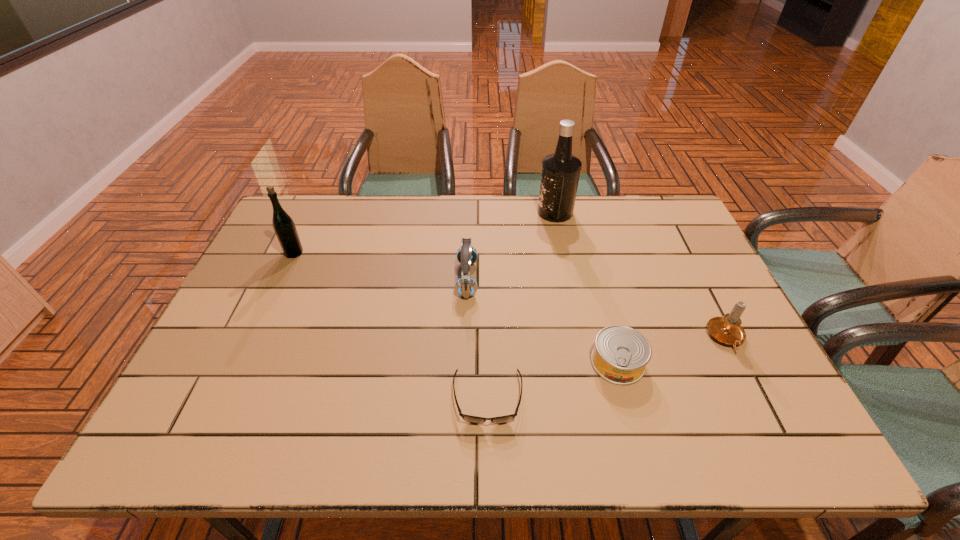
At what (x,y) coordinates should I click in order to perform the action: click on vacant space located on the front label of the farthest object. Please return your answer as a coordinate pair (x, y). This screenshot has width=960, height=540. Looking at the image, I should click on [x=514, y=212].

Where is `free location located 0.080m on the right of the second tallest object`? free location located 0.080m on the right of the second tallest object is located at coordinates (329, 253).

Find the location of a particular element. The height and width of the screenshot is (540, 960). vacant space located on the ear cups of the headset is located at coordinates (557, 279).

I want to click on blank space located on the back of the rightmost object, so click(698, 283).

At what (x,y) coordinates should I click in order to perform the action: click on vacant space positioned 0.400m on the back of the can. Please return your answer as a coordinate pair (x, y). This screenshot has height=540, width=960. Looking at the image, I should click on (585, 241).

In order to click on free region located on the front-facing side of the shortest object in this screenshot , I will do `click(489, 450)`.

Identify the location of object located at the far edge. (560, 174).

The image size is (960, 540). Identify the location of object located at the near edge. (468, 418).

Locate an element on the screen. This screenshot has height=540, width=960. object situated at the left edge is located at coordinates (283, 225).

Find the location of a particular element. The width and height of the screenshot is (960, 540). object that is at the right edge is located at coordinates (727, 329).